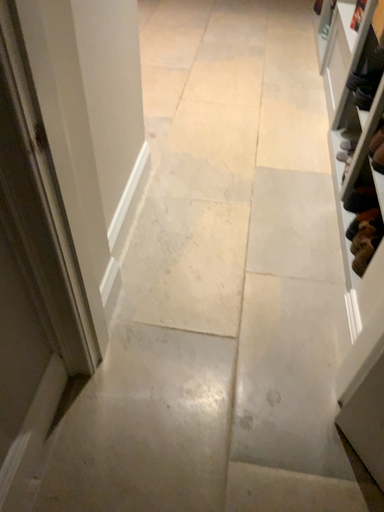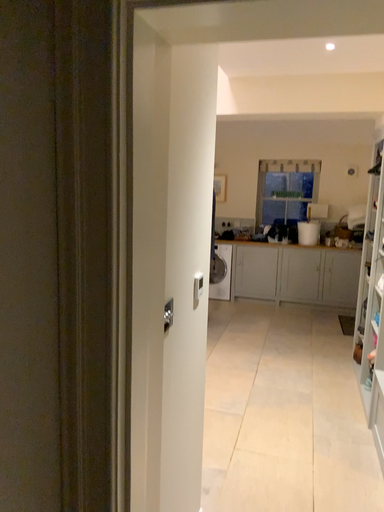
Question: How did the camera likely rotate when shooting the video?

Choices:
 (A) rotated upward
 (B) rotated downward

Answer: (A)